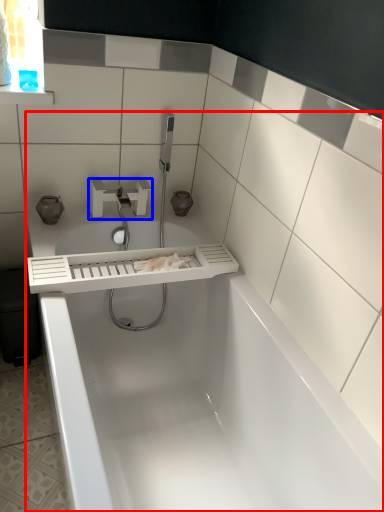
Question: Which point is closer to the camera, bathtub (highlighted by a red box) or tap (highlighted by a blue box)?

Choices:
 (A) bathtub
 (B) tap

Answer: (A)